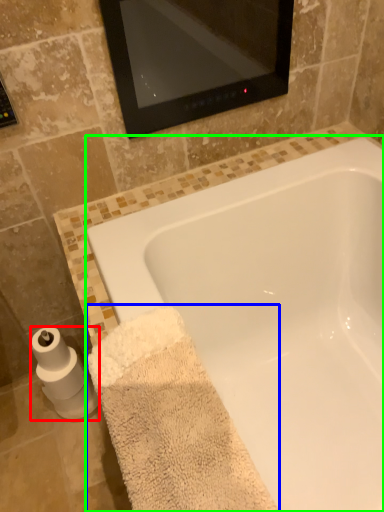
Question: Estimate the real-world distances between objects in this image. Which object is farther from toilet paper (highlighted by a red box), bath towel (highlighted by a blue box) or bathtub (highlighted by a green box)?

Choices:
 (A) bath towel
 (B) bathtub

Answer: (B)